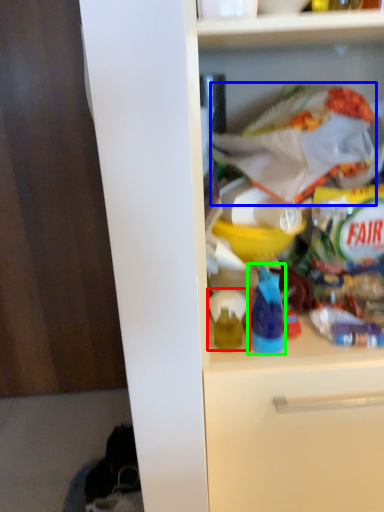
Question: Which object is the closest to the toy (highlighted by a red box)? Choose among these: material (highlighted by a blue box) or bottle (highlighted by a green box).

Choices:
 (A) material
 (B) bottle

Answer: (B)